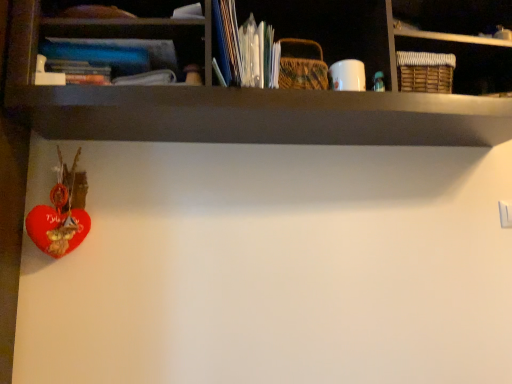
Question: Is velvet red heart at lower left in front of or behind blue hardcover book at upper left in the image?

Choices:
 (A) front
 (B) behind

Answer: (B)

Question: From the image's perspective, is velvet red heart at lower left located above or below blue hardcover book at upper left?

Choices:
 (A) above
 (B) below

Answer: (B)

Question: Visually, is velvet red heart at lower left positioned to the left or to the right of blue hardcover book at upper left?

Choices:
 (A) right
 (B) left

Answer: (B)

Question: Is blue hardcover book at upper left in front of or behind velvet red heart at lower left in the image?

Choices:
 (A) front
 (B) behind

Answer: (A)

Question: From the image's perspective, relative to velvet red heart at lower left, is blue hardcover book at upper left above or below?

Choices:
 (A) above
 (B) below

Answer: (A)

Question: Would you say blue hardcover book at upper left is to the left or to the right of velvet red heart at lower left in the picture?

Choices:
 (A) right
 (B) left

Answer: (A)

Question: From their relative heights in the image, would you say blue hardcover book at upper left is taller or shorter than velvet red heart at lower left?

Choices:
 (A) tall
 (B) short

Answer: (B)